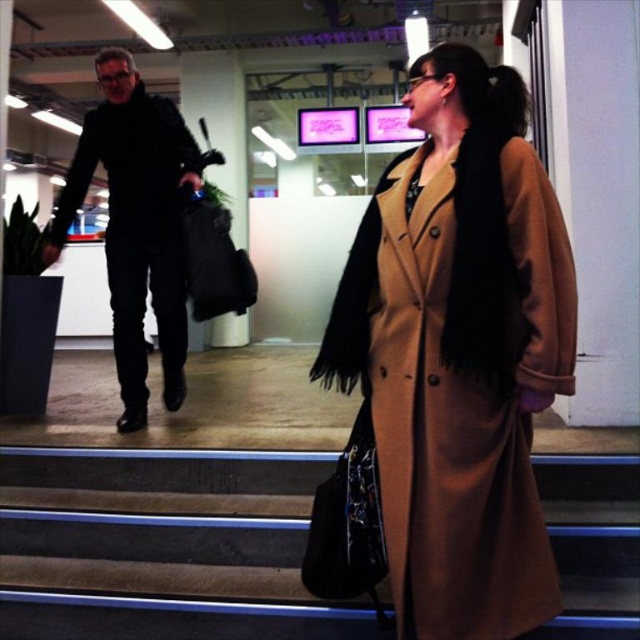
You are an interior designer assessing the space between the tan wool coat at center and the brown wooden stairs at center. Can you determine if the coat is smaller in size than the stairs?

The tan wool coat at center has a smaller size compared to brown wooden stairs at center, so yes, the coat is indeed smaller in size than the stairs.

In the scene shown: You are a security guard in the office. You need to determine which item is smaller between the tan wool coat at center and the black matte jacket at left. Which one should you report?

The tan wool coat at center is smaller than the black matte jacket at left, so you should report the tan wool coat at center as the smaller item.

You are standing at the entrance of the office and need to reach the upper level where the meeting room is located. The brown wooden stairs at center are your only option. Can you confirm the exact position of the stairs to ensure a safe approach?

The brown wooden stairs at center are positioned at coordinates point (x=163, y=548), which means they are located towards the right side and slightly above the center of the image, allowing for a safe and direct path to the upper level.